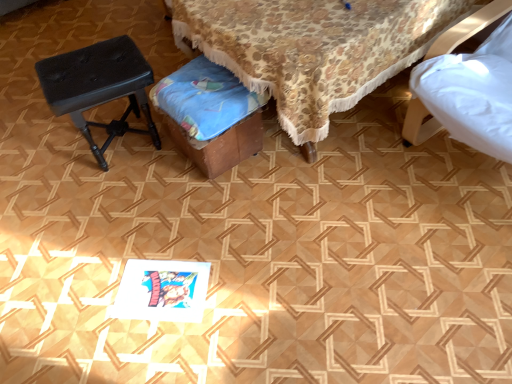
This screenshot has width=512, height=384. In order to click on free space to the left of black leather stool at left in this screenshot , I will do `click(48, 157)`.